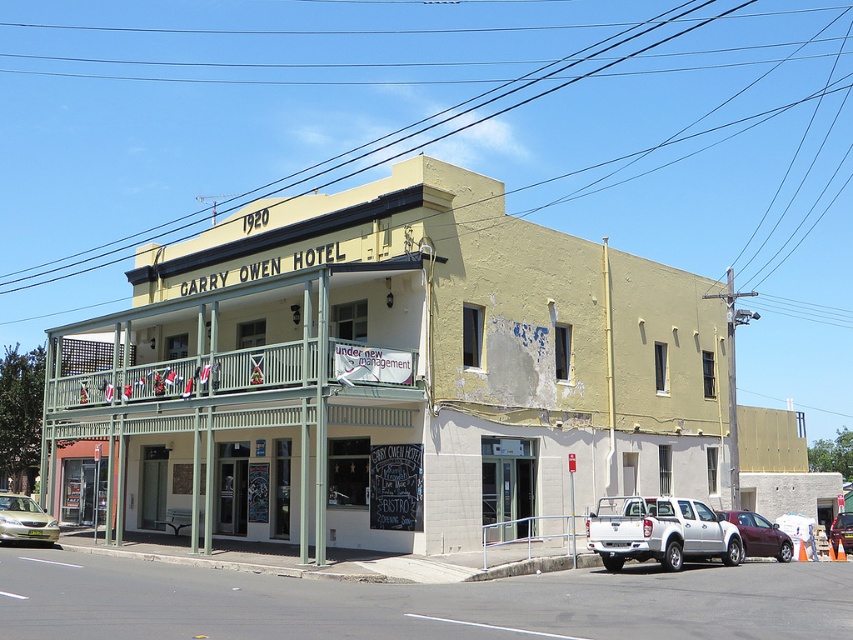
You are a delivery person trying to park your metallic silver sedan at center in front of the Garry Owen Hotel. The green painted wood balcony at center is in the way. Can you park your car there without hitting the balcony?

The green painted wood balcony at center is much taller than the metallic silver sedan at center, so parking the car there would not cause a collision with the balcony.

You are standing in front of the Garry Owen Hotel. Looking at the building, can you tell me the position of the yellow painted building at center relative to the green painted wood balcony at center?

The yellow painted building at center is to the right of the green painted wood balcony at center.